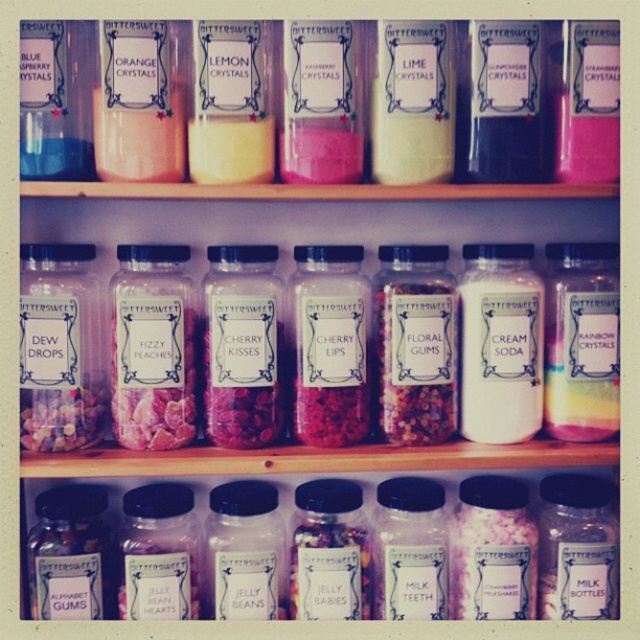
Question: Which point is farther to the camera?

Choices:
 (A) white matte cream soda at center right
 (B) translucent plastic jelly beans at center
 (C) white matte lime crystals at center
 (D) pink matte jelly at center

Answer: (B)

Question: Does yellow crystals at center have a smaller size compared to pink crystal at upper right?

Choices:
 (A) yes
 (B) no

Answer: (B)

Question: In this image, where is pink crystal at center located relative to white matte lime crystals at center?

Choices:
 (A) below
 (B) above

Answer: (A)

Question: Considering the relative positions of white matte cream soda at center right and pink crystal at center in the image provided, where is white matte cream soda at center right located with respect to pink crystal at center?

Choices:
 (A) left
 (B) right

Answer: (B)

Question: Among these objects, which one is farthest from the camera?

Choices:
 (A) white matte lime crystals at center
 (B) yellow crystals at center
 (C) pink crystal at upper right
 (D) orange crystals at center

Answer: (C)

Question: Which object appears farthest from the camera in this image?

Choices:
 (A) orange crystals at center
 (B) pink crystal at upper right
 (C) white matte lime crystals at center
 (D) white matte cream soda at center right

Answer: (D)